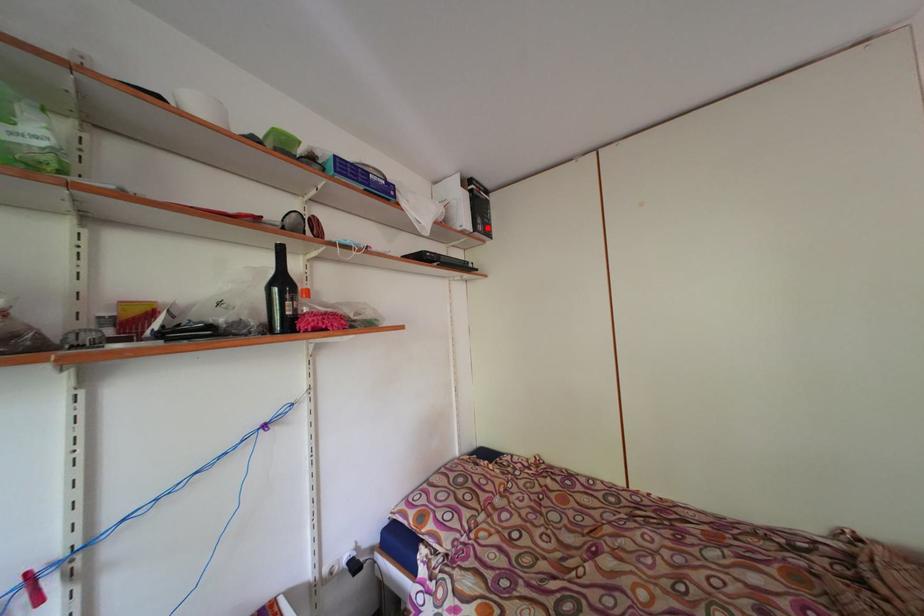
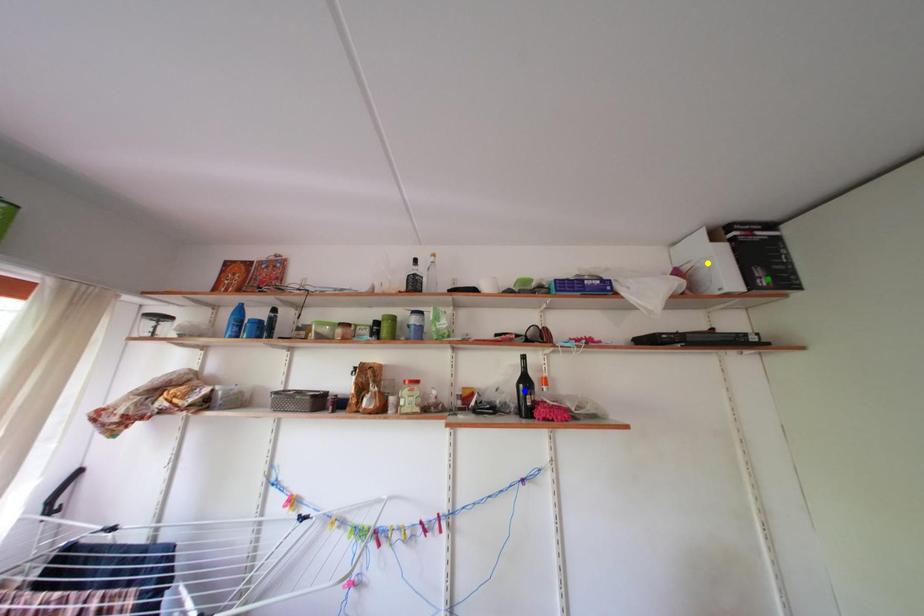
Question: I am providing you with two images of the same scene from different viewpoints. A red point is marked on the first image. You are given multiple points on the second image. Which point in image 2 represents the same 3d spot as the red point in image 1?

Choices:
 (A) green point
 (B) yellow point
 (C) blue point

Answer: (A)